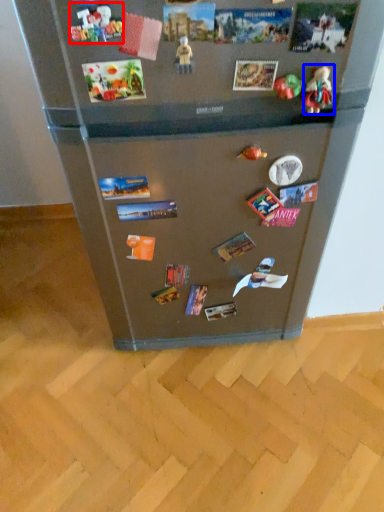
Question: Which object appears farthest to the camera in this image, toy (highlighted by a red box) or toy (highlighted by a blue box)?

Choices:
 (A) toy
 (B) toy

Answer: (B)